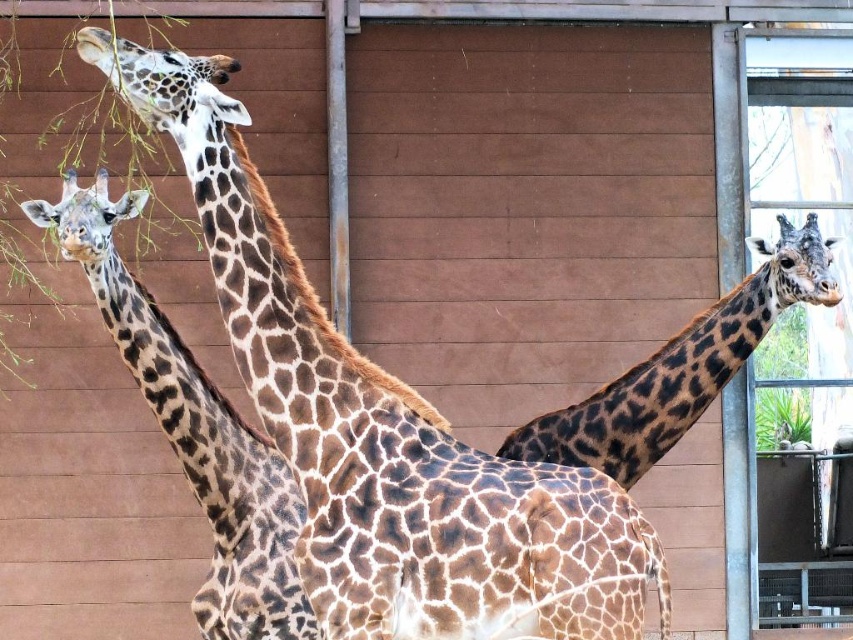
Question: Estimate the real-world distances between objects in this image. Which object is farther from the brown spotted giraffe at upper left?

Choices:
 (A) brown spotted giraffe at left
 (B) spotted fur giraffe at right

Answer: (B)

Question: Estimate the real-world distances between objects in this image. Which object is farther from the spotted fur giraffe at right?

Choices:
 (A) brown spotted giraffe at left
 (B) brown spotted giraffe at upper left

Answer: (B)

Question: Considering the relative positions of brown spotted giraffe at upper left and spotted fur giraffe at right in the image provided, where is brown spotted giraffe at upper left located with respect to spotted fur giraffe at right?

Choices:
 (A) below
 (B) above

Answer: (B)

Question: Is brown spotted giraffe at upper left behind spotted fur giraffe at right?

Choices:
 (A) no
 (B) yes

Answer: (A)

Question: Is brown spotted giraffe at upper left smaller than spotted fur giraffe at right?

Choices:
 (A) no
 (B) yes

Answer: (A)

Question: Estimate the real-world distances between objects in this image. Which object is closer to the brown spotted giraffe at left?

Choices:
 (A) brown spotted giraffe at upper left
 (B) spotted fur giraffe at right

Answer: (B)